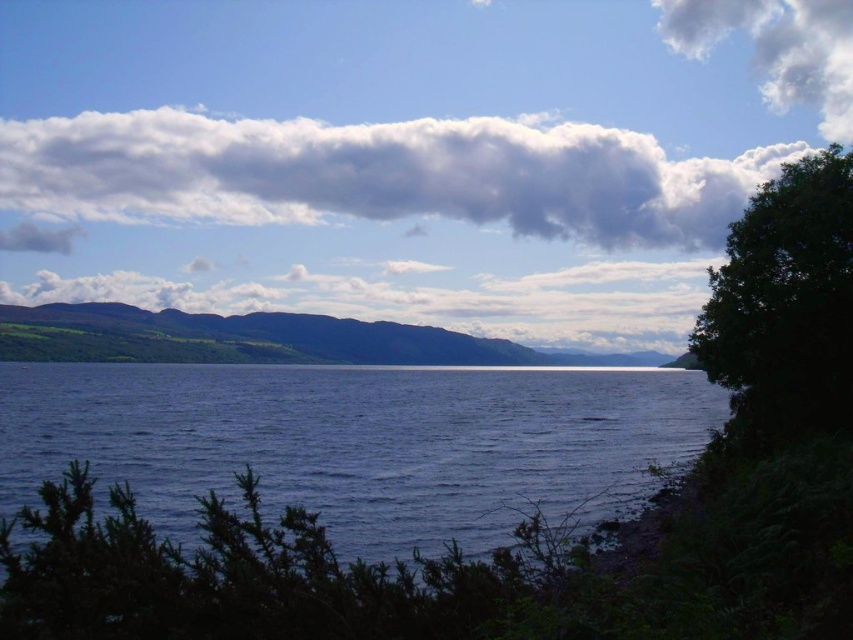
You are standing at a viewpoint overlooking the lake and want to take a photo. You have two points marked on your viewfinder at coordinates point (x=247, y=182) and point (x=827, y=300). Which point is closer to you?

Point (x=247, y=182) is further to the camera than point (x=827, y=300), so the point closer to you is point (x=827, y=300).

You are an environmental scientist assessing the water quality of the lake. You observe the dark blue water at center and the green leafy tree at right. Which object occupies a greater area in the image?

The dark blue water at center has a larger size compared to the green leafy tree at right, so the dark blue water at center occupies a greater area in the image.